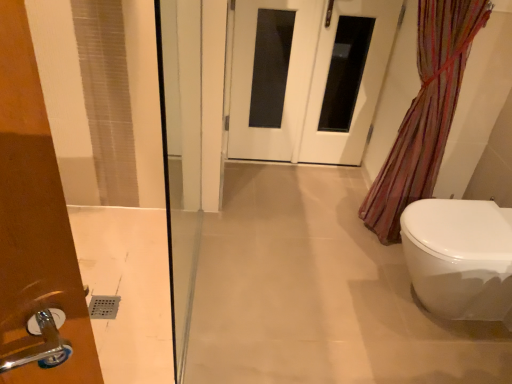
Image resolution: width=512 pixels, height=384 pixels. Find the location of `empty space that is in between white glossy door at center and translucent striped fabric at right`. empty space that is in between white glossy door at center and translucent striped fabric at right is located at coordinates (302, 198).